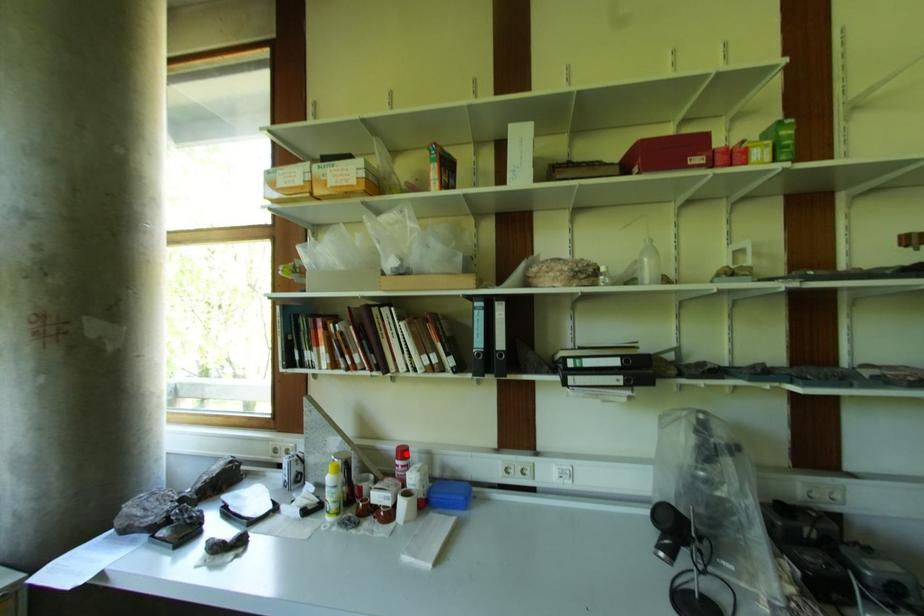
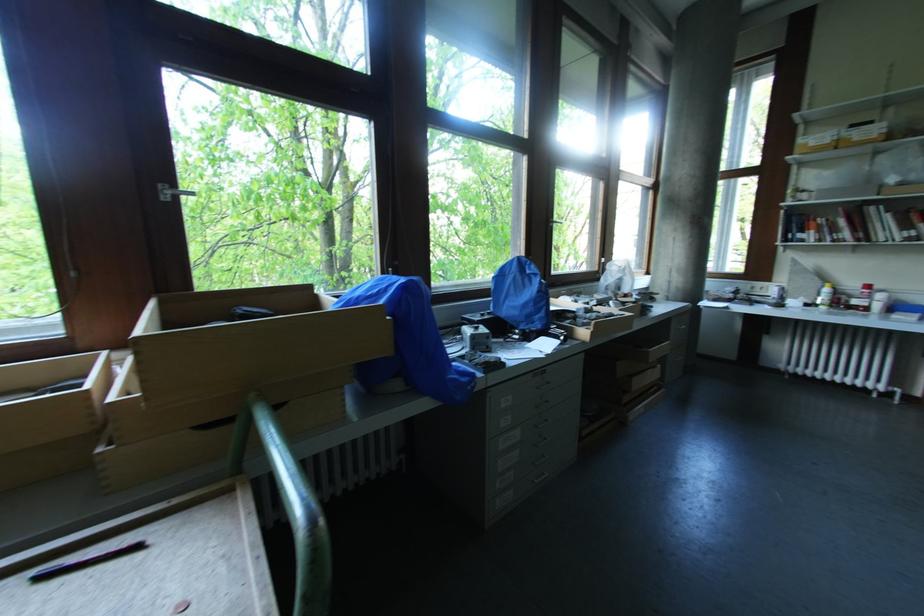
The point at the highlighted location is marked in the first image. Where is the corresponding point in the second image?

(871, 288)